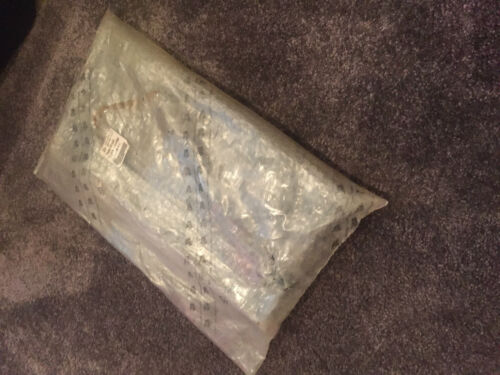
This screenshot has width=500, height=375. Find the location of `carpet to left of package`. carpet to left of package is located at coordinates (29, 100).